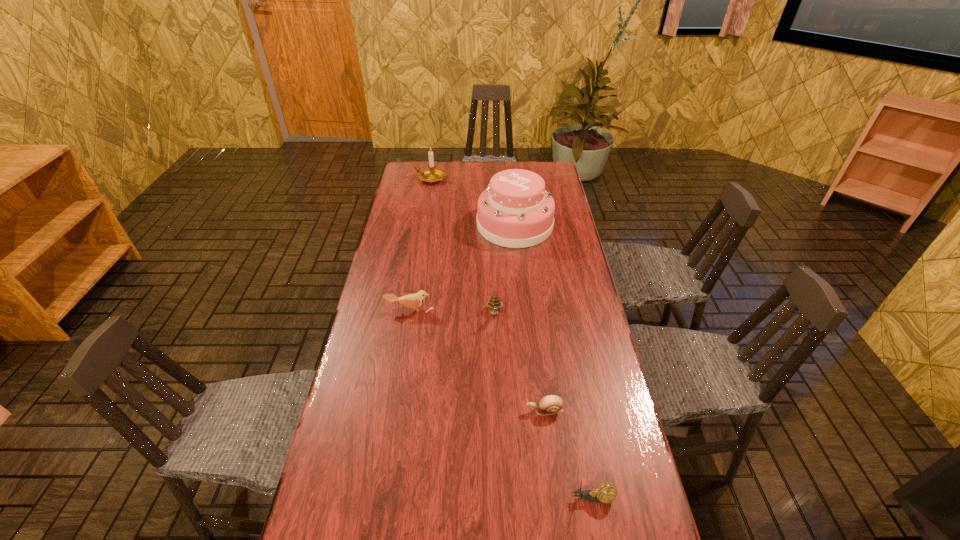
The width and height of the screenshot is (960, 540). I want to click on candle holder that is at the left edge, so click(431, 175).

The height and width of the screenshot is (540, 960). Identify the location of bird that is at the left edge. (411, 300).

Image resolution: width=960 pixels, height=540 pixels. What are the coordinates of `cake at the right edge` in the screenshot? It's located at (515, 211).

Where is `object located in the far left corner section of the desktop`? object located in the far left corner section of the desktop is located at coordinates (431, 175).

Locate an element on the screen. vacant space at the left edge of the desktop is located at coordinates (406, 278).

This screenshot has width=960, height=540. Find the location of `vacant space at the right edge`. vacant space at the right edge is located at coordinates (588, 403).

Where is `vacant space at the far left corner of the desktop`? This screenshot has height=540, width=960. vacant space at the far left corner of the desktop is located at coordinates (407, 179).

I want to click on empty space that is in between the farthest object and the nearest object, so click(x=512, y=338).

At what (x,y) coordinates should I click in order to perform the action: click on free space between the candle holder and the bird. Please return your answer as a coordinate pair (x, y). This screenshot has height=540, width=960. Looking at the image, I should click on (420, 244).

This screenshot has height=540, width=960. Find the location of `vacant region between the bird and the tallest object`. vacant region between the bird and the tallest object is located at coordinates (462, 267).